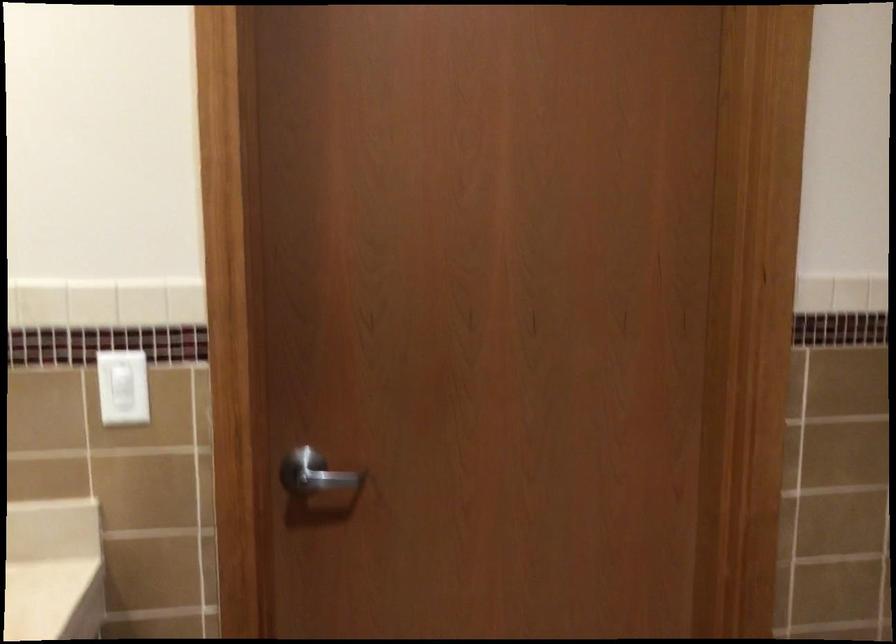
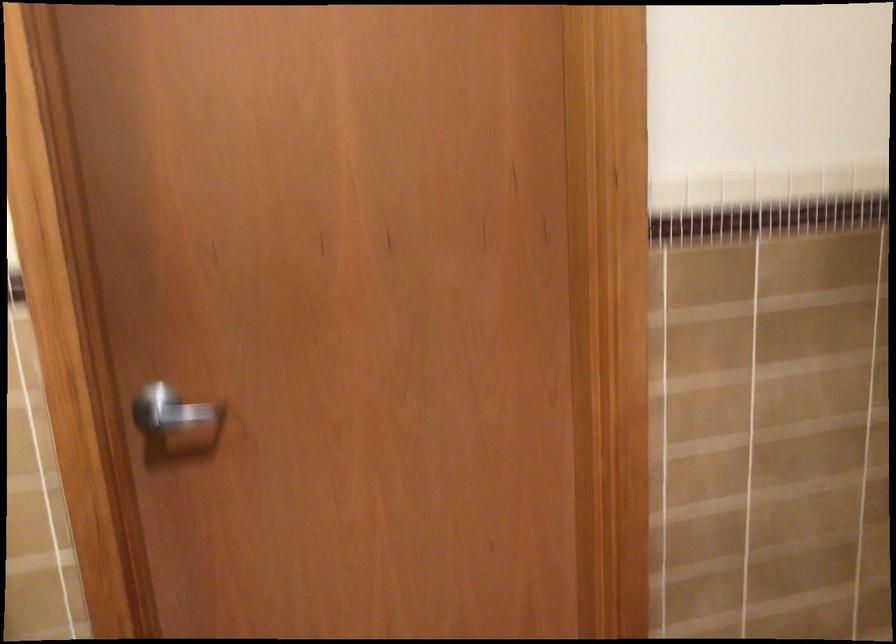
Where in the second image is the point corresponding to pixel 316 473 from the first image?

(170, 412)